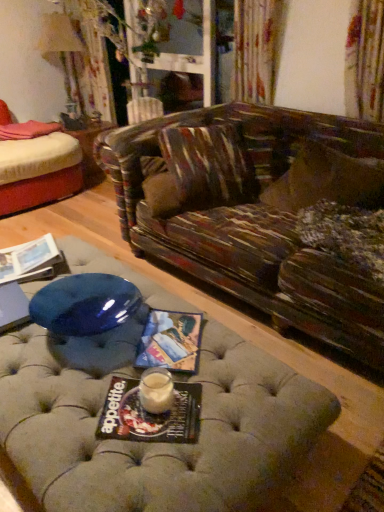
Question: Is point (188, 386) positioned closer to the camera than point (74, 82)?

Choices:
 (A) farther
 (B) closer

Answer: (B)

Question: Looking at the image, does matte black magazine at center, acting as the 2th magazine starting from the left, seem bigger or smaller compared to matte cream lampshade at upper left?

Choices:
 (A) big
 (B) small

Answer: (B)

Question: Which of these objects is positioned farthest from the matte paper magazine at center, the second magazine viewed from the back?

Choices:
 (A) matte cream lampshade at upper left
 (B) matte black magazine at center, which is the first magazine from bottom to top
 (C) fluffy brown pillow at right
 (D) matte paper magazine at lower left, which is the 1th magazine from back to front
 (E) wooden side table at center

Answer: (A)

Question: Based on their relative distances, which object is nearer to the matte paper magazine at center, the second magazine viewed from the front?

Choices:
 (A) fluffy brown pillow at right
 (B) matte black magazine at center, acting as the 2th magazine starting from the left
 (C) wooden side table at center
 (D) matte paper magazine at lower left, which ranks as the third magazine in right-to-left order
 (E) matte cream lampshade at upper left

Answer: (B)